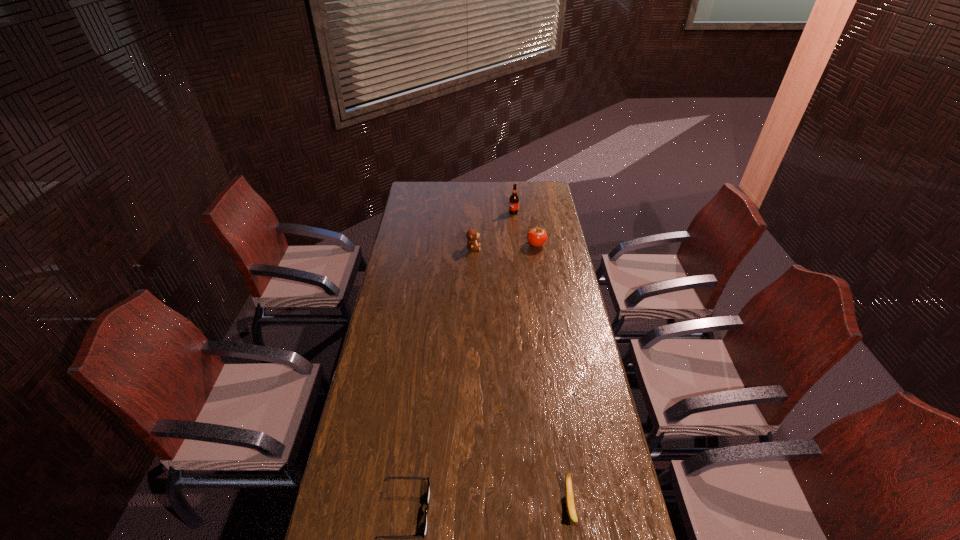
The height and width of the screenshot is (540, 960). I want to click on empty location between the farthest object and the tomato, so click(525, 228).

At what (x,y) coordinates should I click in order to perform the action: click on vacant space that is in between the banana and the tomato. Please return your answer as a coordinate pair (x, y). The width and height of the screenshot is (960, 540). Looking at the image, I should click on (553, 376).

Select which object is the fourth closest to the teddy bear. Please provide its 2D coordinates. Your answer should be formatted as a tuple, i.e. [(x, y)], where the tuple contains the x and y coordinates of a point satisfying the conditions above.

[(570, 504)]

Select which object appears as the fourth closest to the second object from left to right. Please provide its 2D coordinates. Your answer should be formatted as a tuple, i.e. [(x, y)], where the tuple contains the x and y coordinates of a point satisfying the conditions above.

[(570, 504)]

Identify the location of vacant space that satisfies the following two spatial constraints: 1. on the front side of the tallest object; 2. on the face of the second object from left to right. The image size is (960, 540). (517, 248).